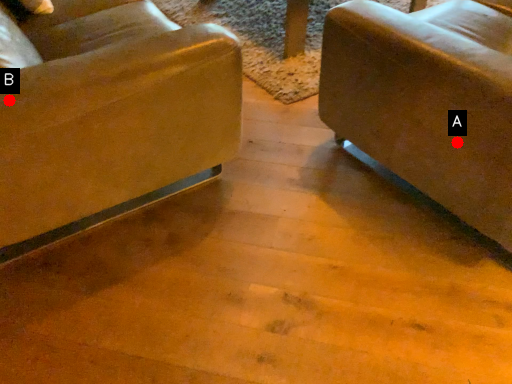
Question: Two points are circled on the image, labeled by A and B beside each circle. Which point is farther from the camera taking this photo?

Choices:
 (A) A is further
 (B) B is further

Answer: (A)